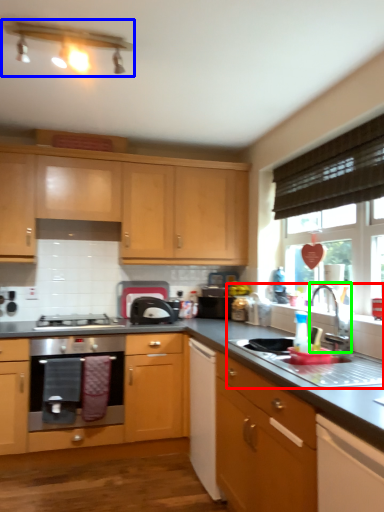
Question: Which object is positioned farthest from sink (highlighted by a red box)? Select from light fixture (highlighted by a blue box) and tap (highlighted by a green box).

Choices:
 (A) light fixture
 (B) tap

Answer: (A)